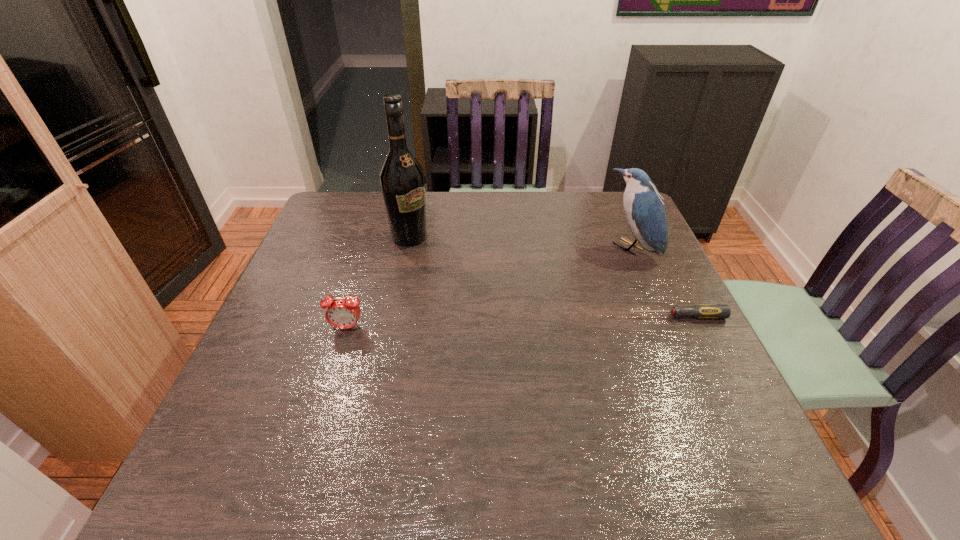
At what (x,y) coordinates should I click in order to perform the action: click on bird that is at the right edge. Please return your answer as a coordinate pair (x, y). Image resolution: width=960 pixels, height=540 pixels. Looking at the image, I should click on (644, 209).

Where is `object at the far right corner`? This screenshot has height=540, width=960. object at the far right corner is located at coordinates (644, 209).

Find the location of a particular element. vacant area at the far edge is located at coordinates (480, 214).

This screenshot has width=960, height=540. Find the location of `free space at the near edge`. free space at the near edge is located at coordinates (404, 433).

Where is `vacant space at the left edge`? vacant space at the left edge is located at coordinates (312, 327).

This screenshot has width=960, height=540. In the image, there is a desktop. Identify the location of vacant space at the far left corner. (358, 193).

The width and height of the screenshot is (960, 540). In the image, there is a desktop. Find the location of `vacant space at the far right corner`. vacant space at the far right corner is located at coordinates (603, 225).

Image resolution: width=960 pixels, height=540 pixels. In the image, there is a desktop. Identify the location of vacant space at the near right corner. (700, 406).

Where is `free space that is in between the wine bottle and the second tallest object`? Image resolution: width=960 pixels, height=540 pixels. free space that is in between the wine bottle and the second tallest object is located at coordinates (520, 242).

Locate an element on the screen. This screenshot has width=960, height=540. free space between the tallest object and the nearest object is located at coordinates (378, 282).